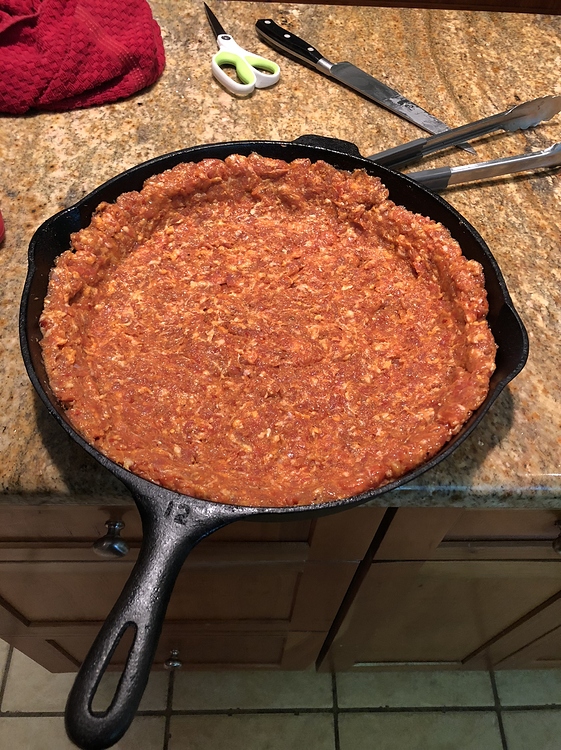
Find the location of a particular element. The image size is (561, 750). countertop is located at coordinates (532, 241).